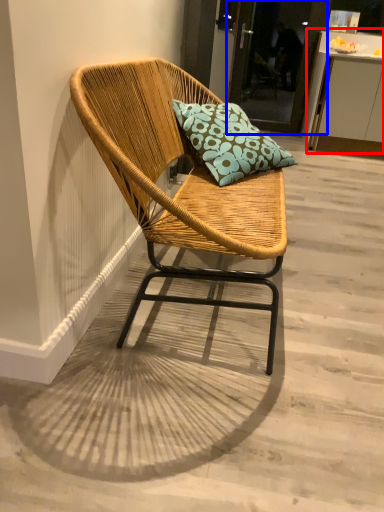
Question: Which point is closer to the camera, table (highlighted by a red box) or glass door (highlighted by a blue box)?

Choices:
 (A) table
 (B) glass door

Answer: (A)